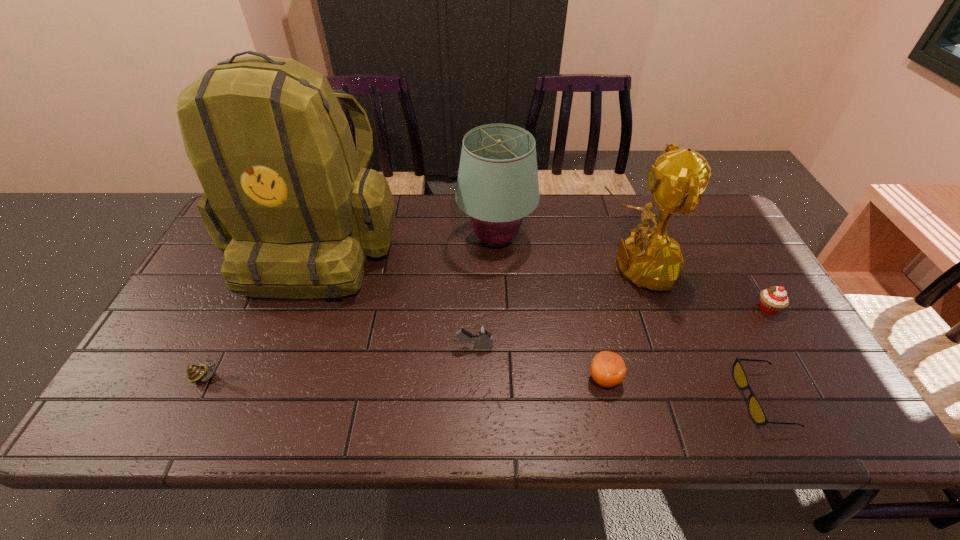
Identify the location of free space located 0.200m on the front side of the award. The image size is (960, 540). (522, 267).

Locate an element on the screen. This screenshot has height=540, width=960. vacant space situated on the front side of the award is located at coordinates (547, 267).

The height and width of the screenshot is (540, 960). I want to click on vacant space located 0.300m on the front side of the award, so click(x=488, y=267).

You are a GUI agent. You are given a task and a screenshot of the screen. Output one action in this format:
    pyautogui.click(x=<x>, y=<y>)
    Task: Click on the vacant space located on the right of the lampshade
    
    Given the screenshot: What is the action you would take?
    pyautogui.click(x=599, y=240)

Where is `free space located 0.090m on the back of the fifth farthest object`? This screenshot has height=540, width=960. free space located 0.090m on the back of the fifth farthest object is located at coordinates (474, 311).

Where is `vacant region located 0.150m on the front of the rightmost object`? The height and width of the screenshot is (540, 960). vacant region located 0.150m on the front of the rightmost object is located at coordinates (803, 368).

Where is `free spot located 0.330m on the right of the orange`? The image size is (960, 540). free spot located 0.330m on the right of the orange is located at coordinates (763, 379).

In order to click on vacant space located on the face of the snail in this screenshot , I will do `click(359, 377)`.

At what (x,y) coordinates should I click in order to perform the action: click on free point located on the front-facing side of the sunglasses. Please return your answer as a coordinate pair (x, y). This screenshot has width=960, height=540. Looking at the image, I should click on (702, 399).

Identify the location of vacant region located on the front-facing side of the sunglasses. The height and width of the screenshot is (540, 960). (612, 399).